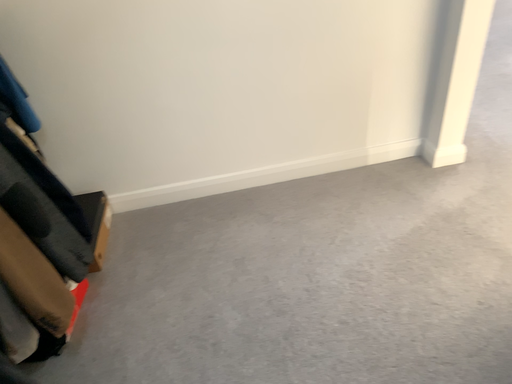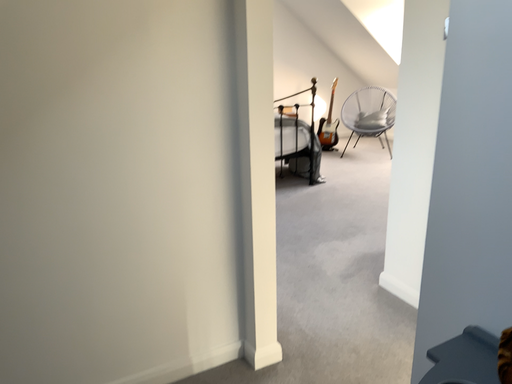
Question: Which way did the camera rotate in the video?

Choices:
 (A) rotated right
 (B) rotated left

Answer: (A)